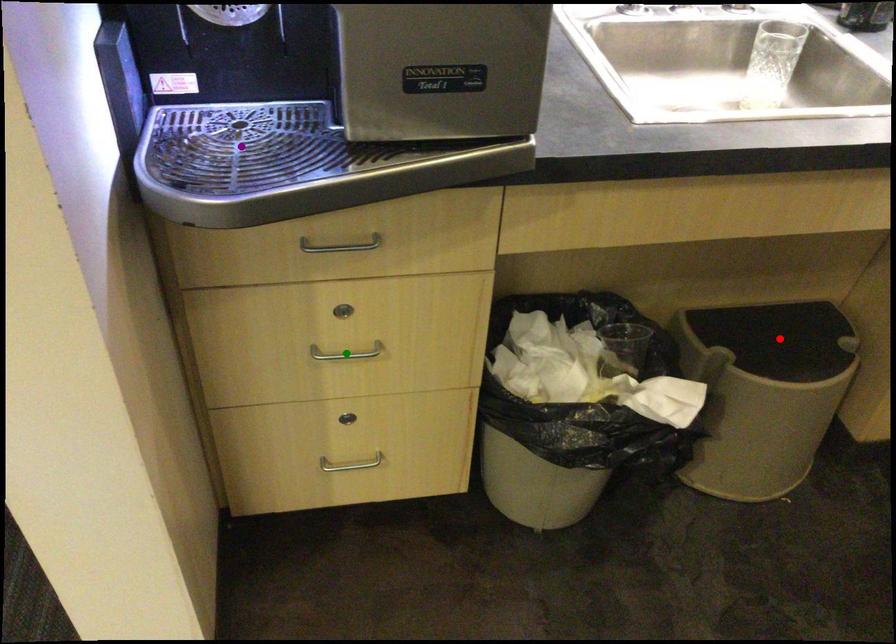
Order these from nearest to farthest:
purple point, red point, green point

purple point, green point, red point